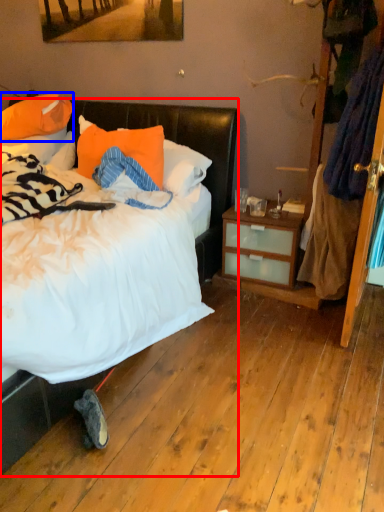
Question: Which point is closer to the camera, bed (highlighted by a red box) or pillow (highlighted by a blue box)?

Choices:
 (A) bed
 (B) pillow

Answer: (A)